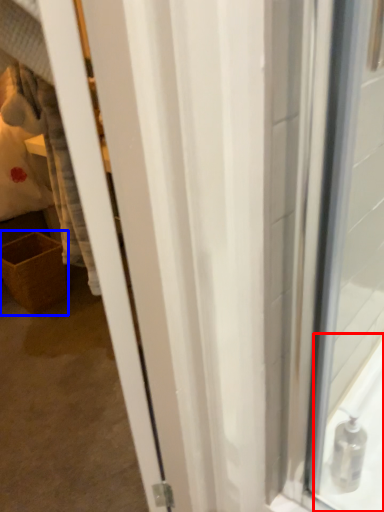
Question: Among these objects, which one is farthest to the camera, bath (highlighted by a red box) or basket (highlighted by a blue box)?

Choices:
 (A) bath
 (B) basket

Answer: (B)